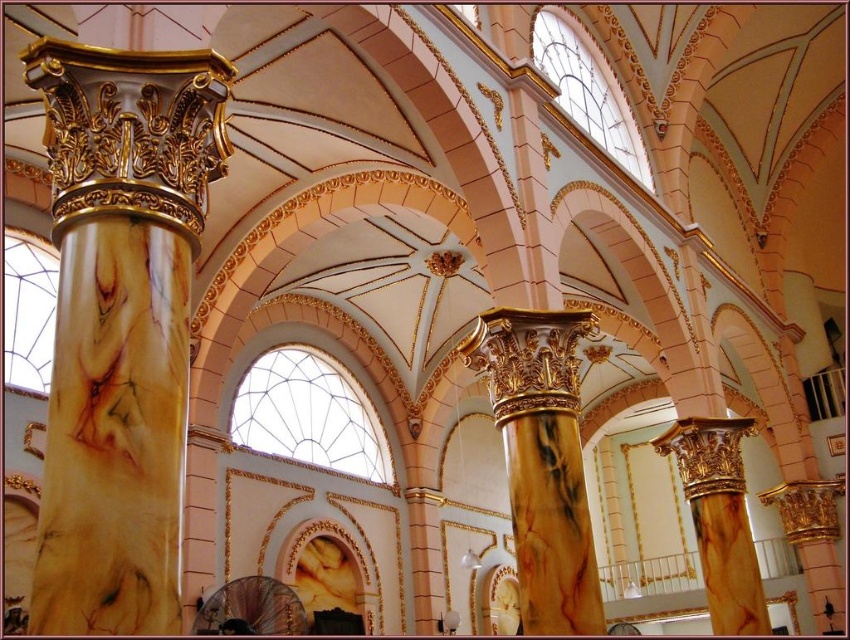
You are an architect assessing the structural integrity of the columns in this cathedral. Given that the marble column at left is narrower than the marble column at center, which column would you expect to support more weight and why?

The marble column at center can support more weight because it is wider than the marble column at left, and wider columns generally have greater load capacity due to their increased cross sectional area.

You are standing in the grand cathedral and want to take a photo of both the marble column at left and marble column at right. Which column should you focus on first if you want to capture their full height in the frame?

The marble column at left is much taller than the marble column at right, so you should focus on the marble column at left first to ensure its full height is captured in the frame.